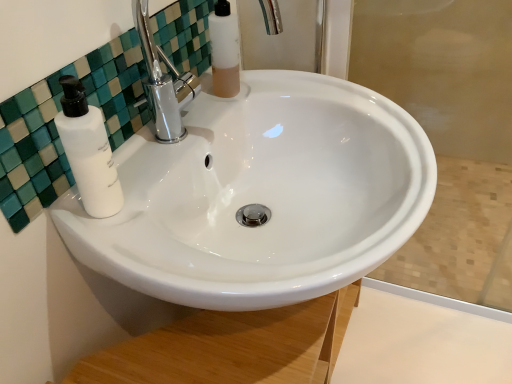
You are a GUI agent. You are given a task and a screenshot of the screen. Output one action in this format:
    pyautogui.click(x=<x>, y=<y>)
    Task: Click on the vacant area that lies to the right of white matte soap dispenser at left
    The image size is (512, 384).
    Given the screenshot: What is the action you would take?
    pyautogui.click(x=195, y=247)